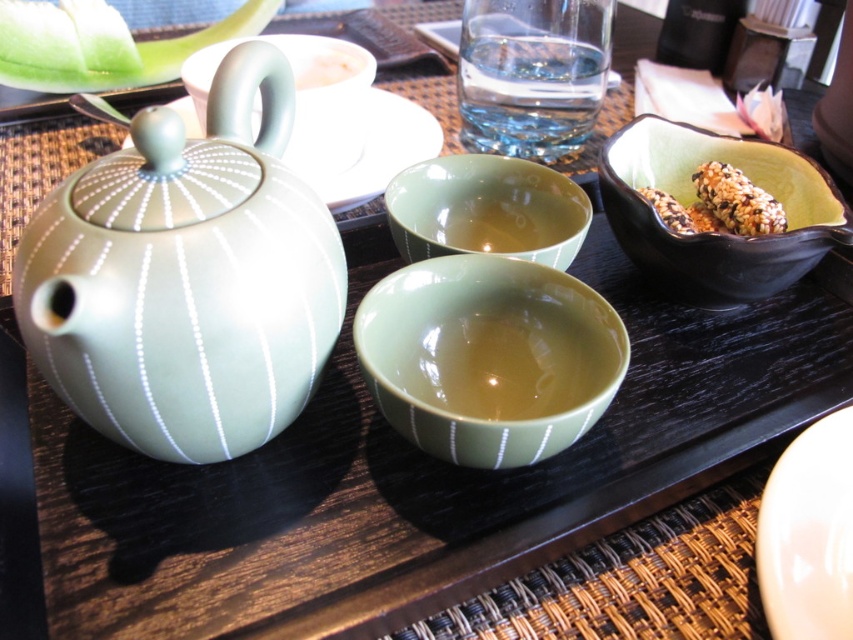
You are standing in front of the tea set on the dark wooden tray. There are two points marked on the tray. The first point is at coordinates point (62, 184) and the second point is at point (656, 200). Which point is closer to you?

Point (62, 184) is in front of point (656, 200), so it is closer to you.

You are holding a small toy that is 8 inches long and want to place it on the table where the satin green teapot at left is located. Can the toy fit in front of the teapot without overlapping it?

The satin green teapot at left is 9.08 inches away from the viewer. Since the toy is 8 inches long, it can fit in front of the teapot as there is enough space between the viewer and the teapot.